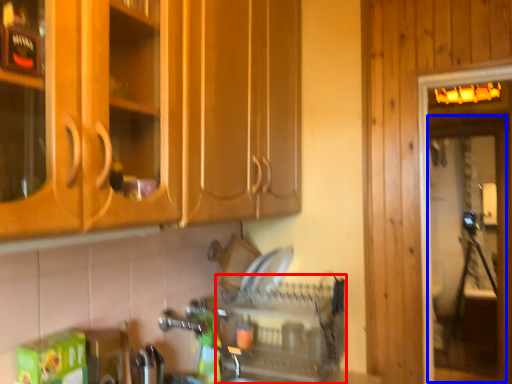
Question: Which object appears farthest to the camera in this image, dish washer (highlighted by a red box) or screen door (highlighted by a blue box)?

Choices:
 (A) dish washer
 (B) screen door

Answer: (B)